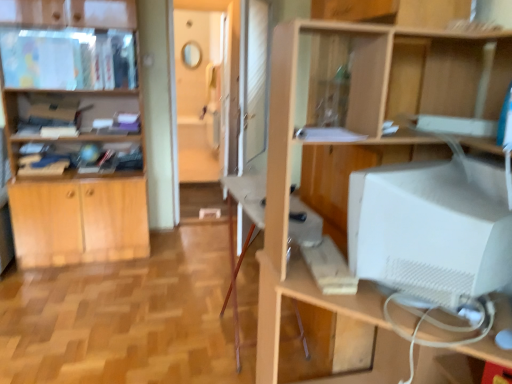
At what (x,y) coordinates should I click in order to perform the action: click on vacant space that is in between light wood cabinet at left and wooden computer desk at center. Please return your answer as a coordinate pair (x, y). Looking at the image, I should click on [151, 292].